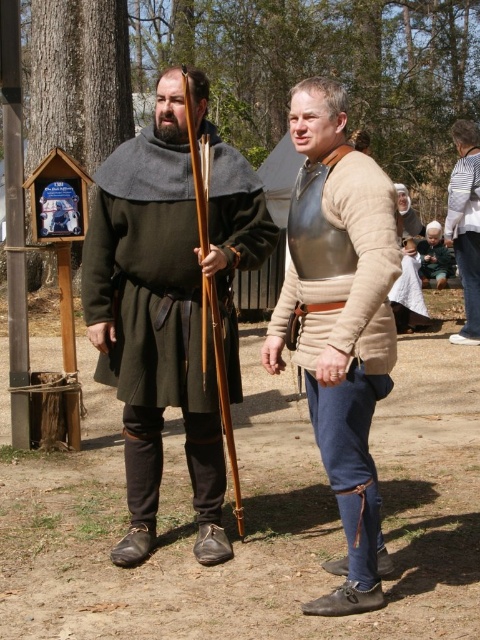
Question: Does striped cotton sweater at upper right have a smaller size compared to green woolen cloak at center?

Choices:
 (A) yes
 (B) no

Answer: (A)

Question: Which point appears closest to the camera in this image?

Choices:
 (A) (196, 508)
 (B) (420, 252)

Answer: (A)

Question: Which object is positioned closest to the green woolen tunic at center?

Choices:
 (A) green woolen cloak at center
 (B) metallic armor at center
 (C) striped cotton sweater at upper right

Answer: (B)

Question: Is green woolen tunic at center smaller than green woolen cloak at center?

Choices:
 (A) no
 (B) yes

Answer: (B)

Question: Which object appears closest to the camera in this image?

Choices:
 (A) striped cotton sweater at upper right
 (B) metallic armor at center
 (C) green woolen tunic at center

Answer: (B)

Question: Can you confirm if metallic armor at center is smaller than striped cotton sweater at upper right?

Choices:
 (A) no
 (B) yes

Answer: (B)